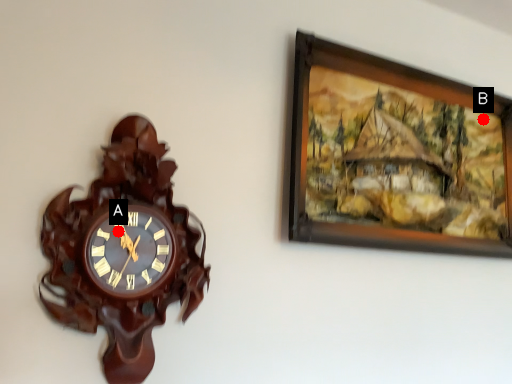
Question: Two points are circled on the image, labeled by A and B beside each circle. Which point is farther to the camera?

Choices:
 (A) A is further
 (B) B is further

Answer: (B)